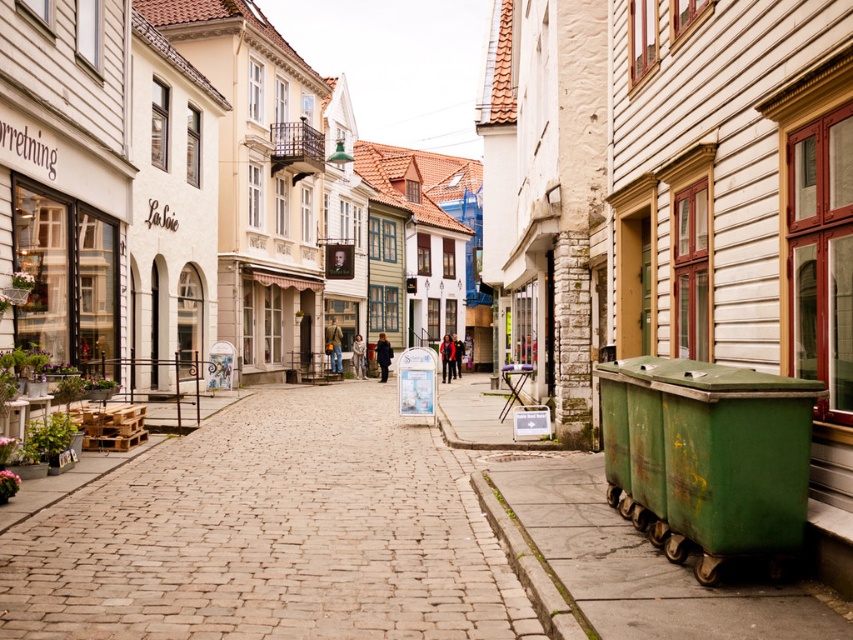
Is brown cobblestone at center thinner than green metallic dumpster at lower right?

Incorrect, brown cobblestone at center's width is not less than green metallic dumpster at lower right's.

Which is behind, point (367, 506) or point (569, 560)?

The point (367, 506) is behind.

At what (x,y) coordinates should I click in order to perform the action: click on brown cobblestone at center. Please return your answer as a coordinate pair (x, y). This screenshot has width=853, height=640. Looking at the image, I should click on (271, 534).